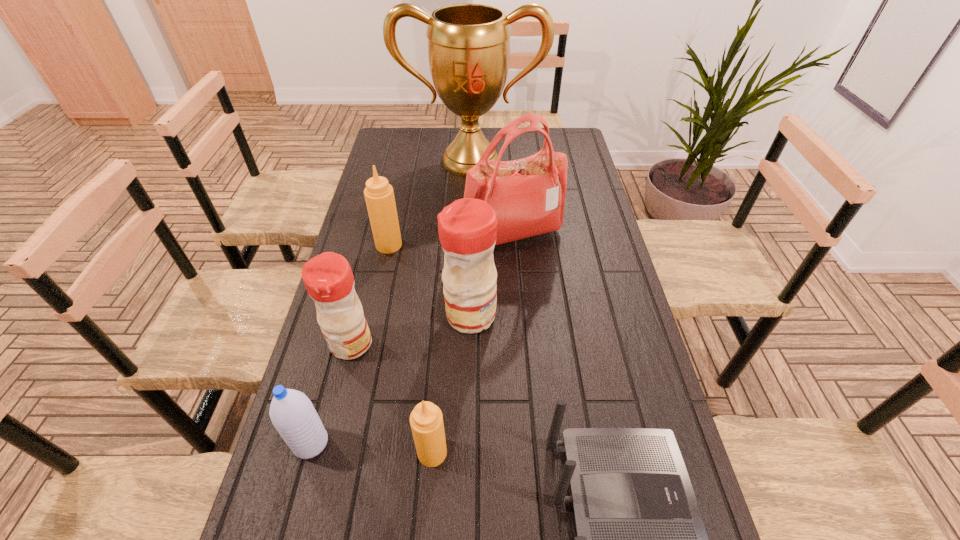
The image size is (960, 540). Find the location of `vacant point located between the nearer tan condiment and the right red condiment`. vacant point located between the nearer tan condiment and the right red condiment is located at coordinates (451, 384).

Locate an element on the screen. The height and width of the screenshot is (540, 960). vacant space that's between the water bottle and the bigger red condiment is located at coordinates (391, 379).

In order to click on free space between the smaller red condiment and the left tan condiment in this screenshot , I will do `click(370, 294)`.

This screenshot has width=960, height=540. Identify the location of free spot between the bigger red condiment and the farthest condiment. (430, 280).

Identify which object is the second closest to the right red condiment. Please provide its 2D coordinates. Your answer should be formatted as a tuple, i.e. [(x, y)], where the tuple contains the x and y coordinates of a point satisfying the conditions above.

[(328, 278)]

Locate an element on the screen. Image resolution: width=960 pixels, height=540 pixels. object identified as the closest to the left red condiment is located at coordinates 292,413.

Locate an element on the screen. condiment that can be found as the closest to the sixth shortest object is located at coordinates (328, 278).

Identify the location of condiment identified as the third closest to the router. This screenshot has height=540, width=960. (328, 278).

This screenshot has height=540, width=960. Find the location of `red condiment that is the closest one to the blue water bottle`. red condiment that is the closest one to the blue water bottle is located at coordinates (328, 278).

At what (x,y) coordinates should I click in order to perform the action: click on free space that satisfies the following two spatial constraints: 1. on the back side of the right red condiment; 2. on the left side of the left red condiment. Please return your answer as a coordinate pair (x, y). The width and height of the screenshot is (960, 540). Looking at the image, I should click on (358, 315).